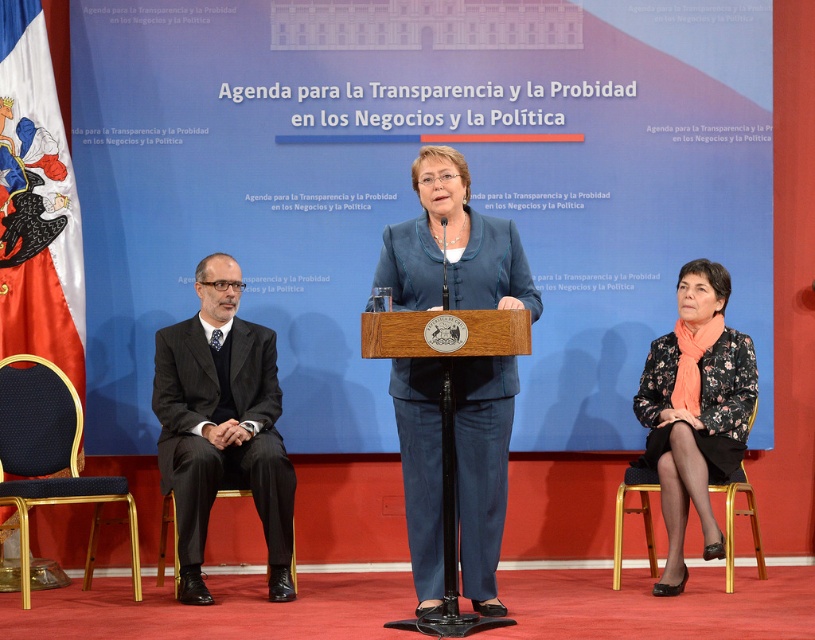
Question: Does black fabric chair at lower left appear on the right side of metallic gold chair at lower right?

Choices:
 (A) yes
 (B) no

Answer: (B)

Question: Is the position of black fabric chair at lower left more distant than that of metallic gold chair at lower right?

Choices:
 (A) yes
 (B) no

Answer: (B)

Question: Is black suit at left wider than metallic gold chair at lower right?

Choices:
 (A) yes
 (B) no

Answer: (A)

Question: Which point is closer to the camera?

Choices:
 (A) (527, 273)
 (B) (725, 493)

Answer: (A)

Question: Which point is farther to the camera?

Choices:
 (A) (86, 500)
 (B) (725, 522)
 (C) (210, 397)
 (D) (499, 416)

Answer: (C)

Question: Which object appears farthest from the camera in this image?

Choices:
 (A) blue fabric business suit at center
 (B) metallic gold chair at lower right
 (C) black fabric chair at lower left
 (D) black suit at left

Answer: (B)